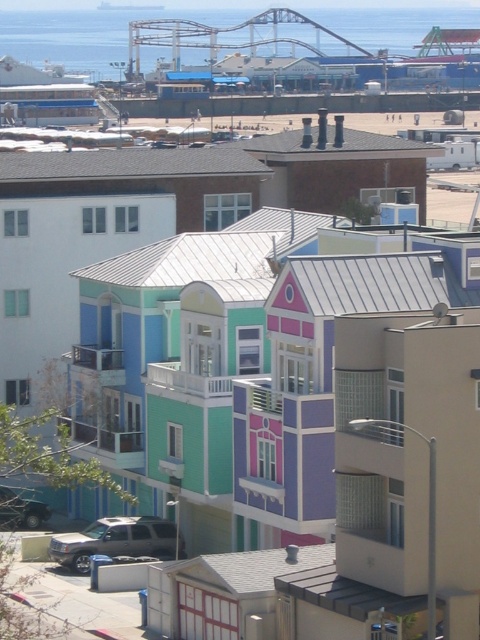
Question: Does silver metallic suv at lower left appear on the right side of metallic silver car at lower left?

Choices:
 (A) no
 (B) yes

Answer: (B)

Question: Is silver metallic suv at lower left further to the viewer compared to metallic silver car at lower left?

Choices:
 (A) no
 (B) yes

Answer: (A)

Question: Which point is closer to the camera taking this photo?

Choices:
 (A) (148, 540)
 (B) (14, 525)

Answer: (A)

Question: Among these objects, which one is nearest to the camera?

Choices:
 (A) metallic silver car at lower left
 (B) silver metallic suv at lower left

Answer: (B)

Question: From the image, what is the correct spatial relationship of silver metallic suv at lower left in relation to metallic silver car at lower left?

Choices:
 (A) above
 (B) below

Answer: (B)